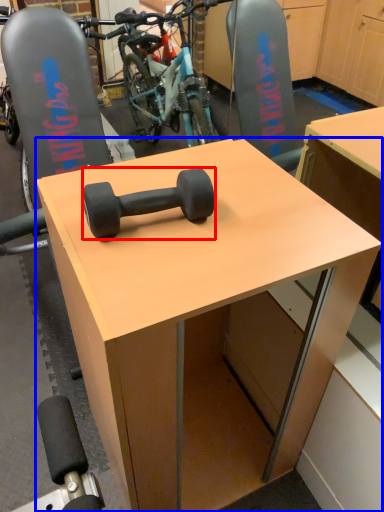
Question: Which point is closer to the camera, dumbbell (highlighted by a red box) or desk (highlighted by a blue box)?

Choices:
 (A) dumbbell
 (B) desk

Answer: (B)